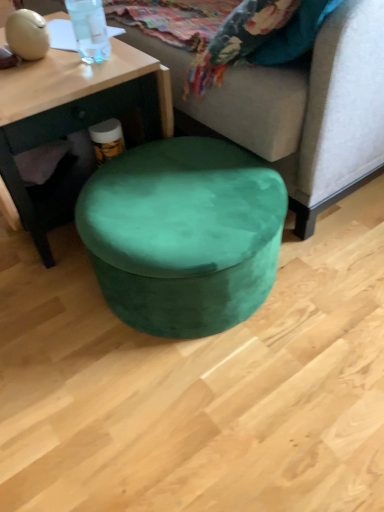
Where is `blank area to the left of transparent plastic bottle at upper left`? This screenshot has width=384, height=512. blank area to the left of transparent plastic bottle at upper left is located at coordinates (46, 69).